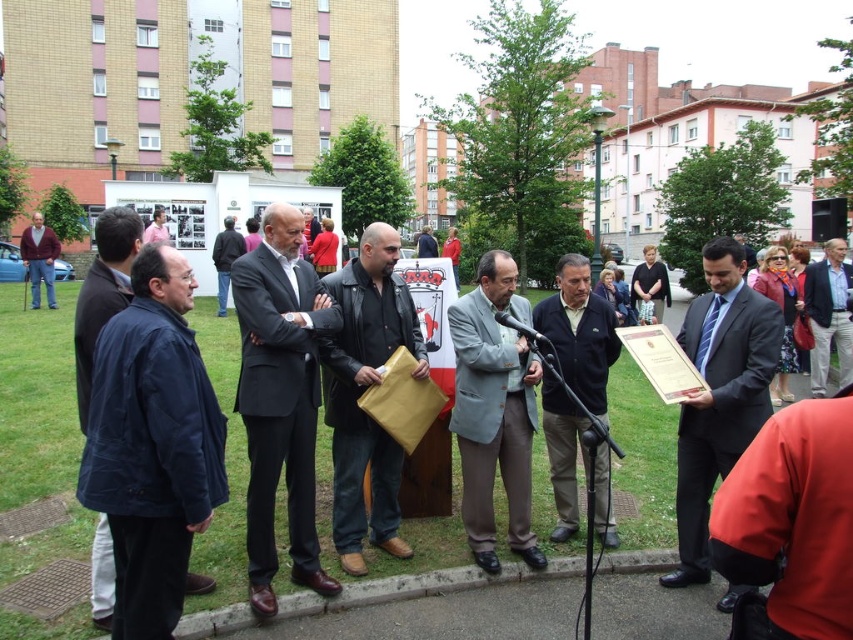
Question: Is black leather jacket at center further to camera compared to light blue shirt at center?

Choices:
 (A) no
 (B) yes

Answer: (A)

Question: In this image, where is dark gray textured blazer at center located relative to black plastic microphone at center?

Choices:
 (A) left
 (B) right

Answer: (B)

Question: Which object appears closest to the camera in this image?

Choices:
 (A) dark blue fabric coat at left
 (B) orange fabric jacket at lower right
 (C) dark gray textured blazer at center

Answer: (B)

Question: Can you confirm if dark gray textured blazer at center is positioned below light blue suit at center?

Choices:
 (A) yes
 (B) no

Answer: (A)

Question: Which object appears farthest from the camera in this image?

Choices:
 (A) maroon fabric jacket at left
 (B) black leather jacket at center
 (C) navy blue jacket at left
 (D) orange fabric jacket at lower right

Answer: (A)

Question: Which point is farther to the camera?

Choices:
 (A) (225, 300)
 (B) (360, 524)

Answer: (A)